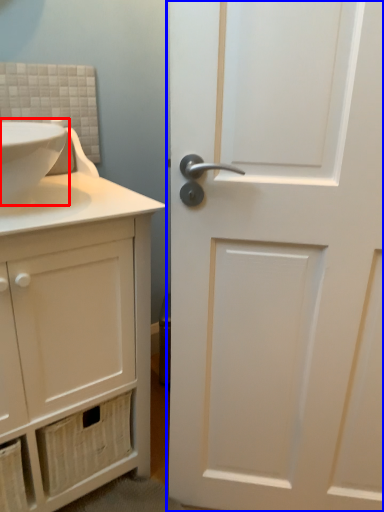
Question: Among these objects, which one is farthest to the camera, sink (highlighted by a red box) or door (highlighted by a blue box)?

Choices:
 (A) sink
 (B) door

Answer: (A)